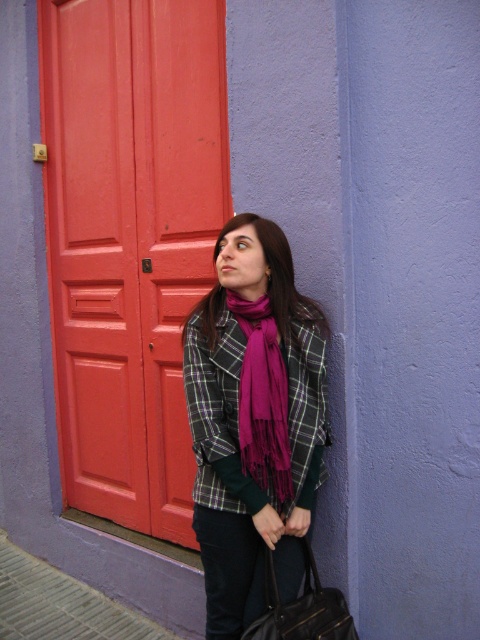
In the scene shown: You are a fashion designer observing the image. You need to decide which item is more suitable for a compact accessory collection focused on smaller items. Which object between the plaid fabric at center and the leather handbag at lower center should you exclude?

The plaid fabric at center is larger in size than the leather handbag at lower center, so you should exclude the plaid fabric at center from the compact accessory collection.

Where is the plaid woolen jacket at center located in the image?

The plaid woolen jacket at center is located at point [252,420] in the image.

You are a photographer trying to capture the leather handbag at lower center in the image. However, the plaid fabric at center is blocking your view. Can you adjust your position to see the handbag without moving any objects?

The leather handbag at lower center is behind the plaid fabric at center, so you can move your position to the side or angle your camera to see around the plaid fabric at center and capture the handbag.